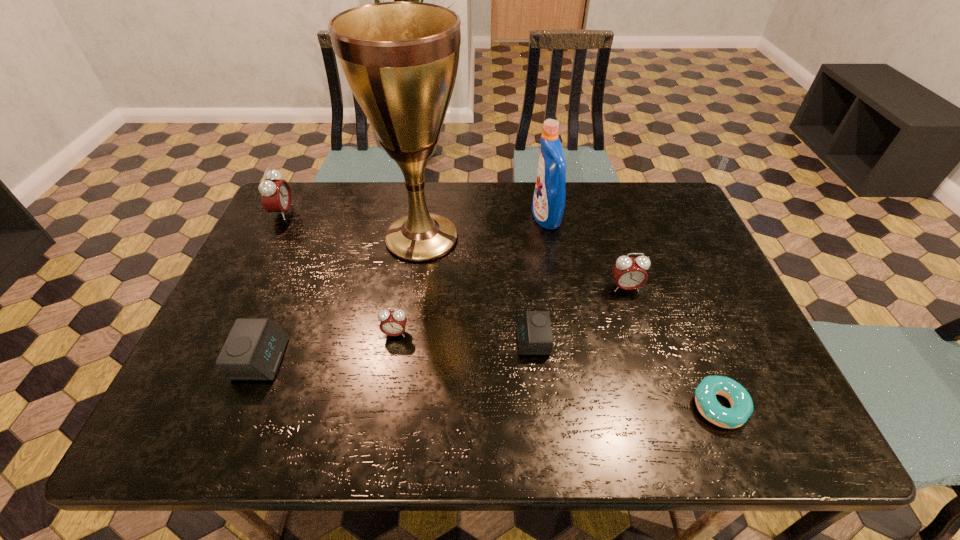
The image size is (960, 540). In order to click on the fourth alarm clock from right to left in this screenshot , I will do `click(253, 350)`.

At what (x,y) coordinates should I click in order to perform the action: click on the bigger black alarm clock. Please return your answer as a coordinate pair (x, y). Looking at the image, I should click on (253, 350).

The height and width of the screenshot is (540, 960). I want to click on the seventh tallest object, so click(534, 334).

The image size is (960, 540). Identify the location of the right black alarm clock. (534, 334).

Find the location of a particular element. doughnut is located at coordinates (740, 400).

I want to click on the shortest object, so click(740, 400).

At what (x,y) coordinates should I click in order to perform the action: click on free space located 0.150m on the right of the trophy cup. Please return your answer as a coordinate pair (x, y). Looking at the image, I should click on (518, 238).

Locate an element on the screen. The width and height of the screenshot is (960, 540). vacant space situated on the label of the detergent is located at coordinates pyautogui.click(x=418, y=218).

I want to click on blank space located 0.150m on the label of the detergent, so click(483, 218).

Identify the location of free spot located on the label of the detergent. This screenshot has width=960, height=540. (437, 218).